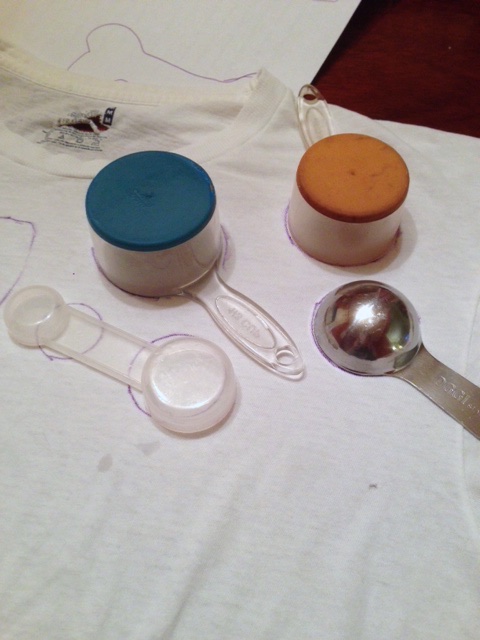
The height and width of the screenshot is (640, 480). Find the location of `table`. table is located at coordinates coord(430,186).